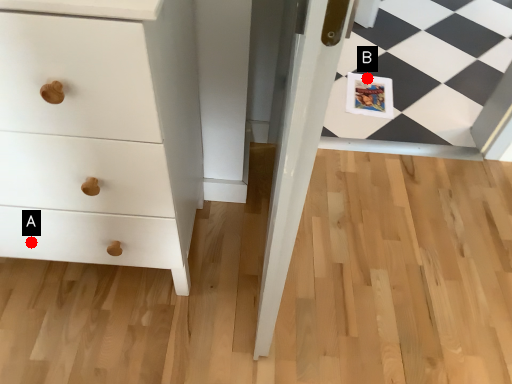
Question: Two points are circled on the image, labeled by A and B beside each circle. Which of the following is the closest to the observer?

Choices:
 (A) A is closer
 (B) B is closer

Answer: (A)